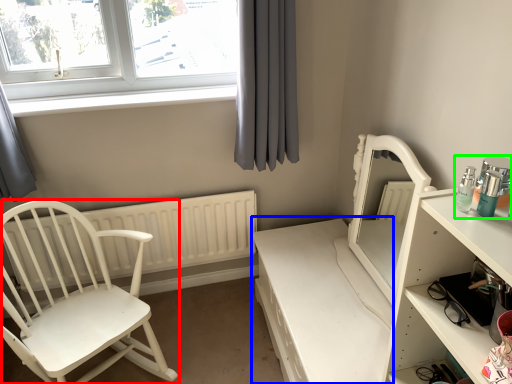
Question: Based on their relative distances, which object is farther from chair (highlighted by a red box)? Choose from vanity (highlighted by a blue box) and toiletry (highlighted by a green box).

Choices:
 (A) vanity
 (B) toiletry

Answer: (B)